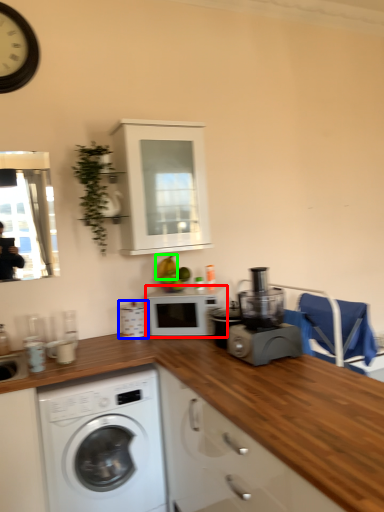
Question: Based on their relative distances, which object is farther from microwave oven (highlighted by a red box)? Choose from appliance (highlighted by a blue box) and fruit (highlighted by a green box).

Choices:
 (A) appliance
 (B) fruit

Answer: (B)